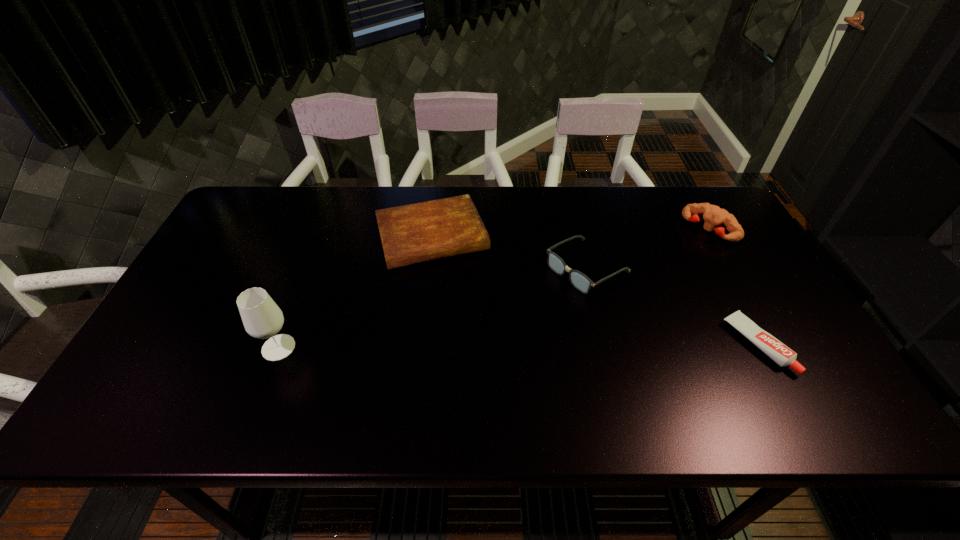
You are a GUI agent. You are given a task and a screenshot of the screen. Output one action in this format:
    pyautogui.click(x=<x>, y=<y>)
    Task: Click on the free space on the desktop that is between the tallest object and the shortest object and is positioned on the spine side of the second shortest object
    This screenshot has width=960, height=540.
    Given the screenshot: What is the action you would take?
    pyautogui.click(x=468, y=347)

What are the coordinates of `free space on the desktop that is between the leftmost object and the shortest object and is positioned with the gloves of the second tallest object facing forward` in the screenshot? It's located at (579, 346).

At what (x,y) coordinates should I click in order to perform the action: click on free space on the desktop that is between the leftmost object and the toothpaste and is positioned on the face of the third object from right to left. Please return your answer as a coordinate pair (x, y). Looking at the image, I should click on (464, 347).